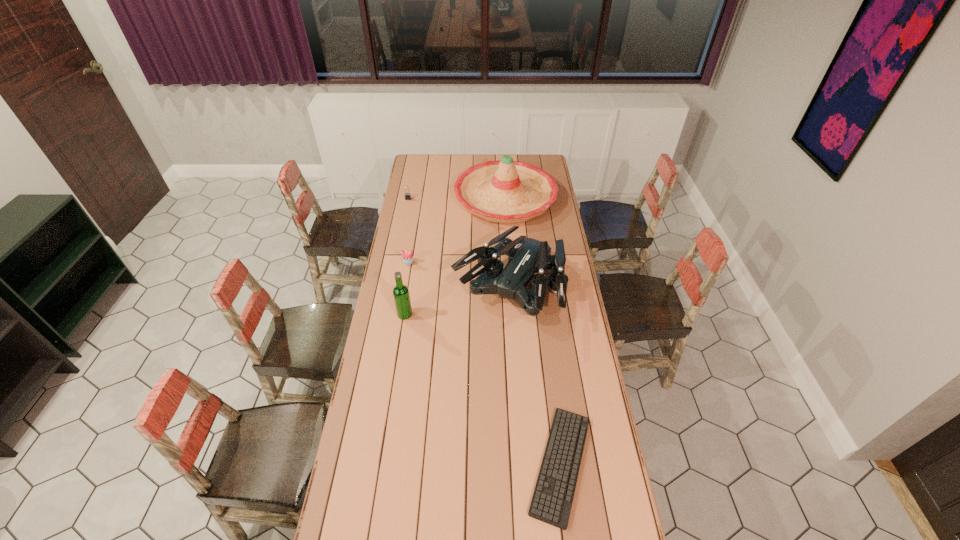
At what (x,y) coordinates should I click in order to perform the action: click on object situated at the far right corner. Please return your answer as a coordinate pair (x, y). The width and height of the screenshot is (960, 540). Looking at the image, I should click on (505, 191).

This screenshot has height=540, width=960. In the image, there is a desktop. Find the location of `free space at the far edge`. free space at the far edge is located at coordinates (466, 157).

In the image, there is a desktop. Identify the location of vacant space at the left edge. [371, 437].

Where is `vacant space at the right edge of the desktop`? vacant space at the right edge of the desktop is located at coordinates (557, 350).

Find the location of `free space between the leftmost object and the cupcake`. free space between the leftmost object and the cupcake is located at coordinates (408, 231).

Find the location of `free spot between the padlock and the cupcake`. free spot between the padlock and the cupcake is located at coordinates (408, 231).

Identify the location of vacant space in between the third tallest object and the cupcake. (459, 275).

You are a GUI agent. You are given a task and a screenshot of the screen. Output one action in this format:
    pyautogui.click(x=<x>, y=<y>)
    Task: Click on the free area in between the cupcake and the shortest object
    This screenshot has width=960, height=540.
    Given the screenshot: What is the action you would take?
    pyautogui.click(x=485, y=363)

Locate which object is the closest to the sombrero. Please provide its 2D coordinates. Your answer should be formatted as a tuple, i.e. [(x, y)], where the tuple contains the x and y coordinates of a point satisfying the conditions above.

[(526, 256)]

Choose which object is the fifth nearest neighbor to the beer bottle. Please provide its 2D coordinates. Your answer should be formatted as a tuple, i.e. [(x, y)], where the tuple contains the x and y coordinates of a point satisfying the conditions above.

[(407, 195)]